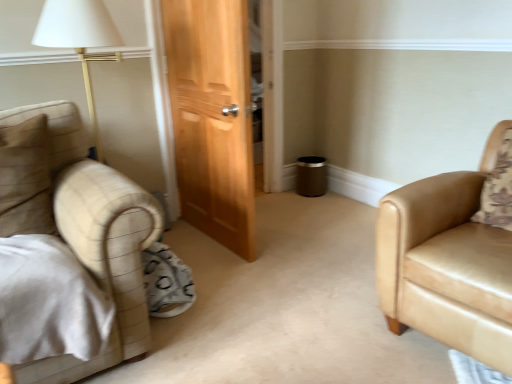
Question: Can you confirm if tan leather armchair at right is bigger than beige fabric pillow at left?

Choices:
 (A) yes
 (B) no

Answer: (A)

Question: From the image's perspective, is tan leather armchair at right below beige fabric pillow at left?

Choices:
 (A) no
 (B) yes

Answer: (B)

Question: Can you confirm if tan leather armchair at right is positioned to the left of beige fabric pillow at left?

Choices:
 (A) yes
 (B) no

Answer: (B)

Question: Is tan leather armchair at right smaller than beige fabric pillow at left?

Choices:
 (A) yes
 (B) no

Answer: (B)

Question: From the image's perspective, is tan leather armchair at right above beige fabric pillow at left?

Choices:
 (A) yes
 (B) no

Answer: (B)

Question: From a real-world perspective, is tan leather armchair at right below beige fabric pillow at left?

Choices:
 (A) yes
 (B) no

Answer: (A)

Question: Is the depth of beige fabric pillow at left less than that of tan leather armchair at right?

Choices:
 (A) yes
 (B) no

Answer: (B)

Question: From a real-world perspective, is beige fabric pillow at left physically below tan leather armchair at right?

Choices:
 (A) yes
 (B) no

Answer: (B)

Question: From a real-world perspective, is beige fabric pillow at left located higher than tan leather armchair at right?

Choices:
 (A) no
 (B) yes

Answer: (B)

Question: Considering the relative positions of beige fabric pillow at left and tan leather armchair at right in the image provided, is beige fabric pillow at left to the right of tan leather armchair at right from the viewer's perspective?

Choices:
 (A) yes
 (B) no

Answer: (B)

Question: Can we say beige fabric pillow at left lies outside tan leather armchair at right?

Choices:
 (A) no
 (B) yes

Answer: (B)

Question: Is beige fabric pillow at left not close to tan leather armchair at right?

Choices:
 (A) no
 (B) yes

Answer: (B)

Question: Which is correct: beige fabric pillow at left is inside tan leather armchair at right, or outside of it?

Choices:
 (A) outside
 (B) inside

Answer: (A)